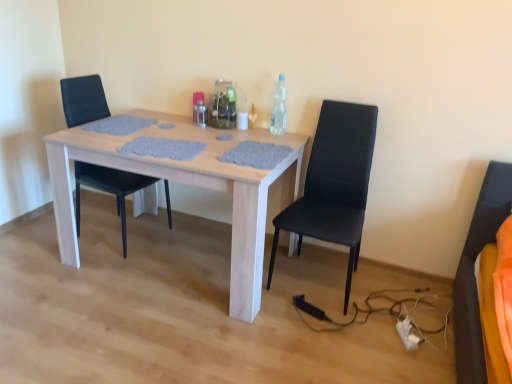
Question: Should I look upward or downward to see black leather chair at center, the 1th chair viewed from the left?

Choices:
 (A) up
 (B) down

Answer: (A)

Question: Which direction should I rotate to look at clear glass bottle at center, the 2th bottle from the left?

Choices:
 (A) right
 (B) left

Answer: (B)

Question: Considering the relative positions of black leather chair at center, marked as the second chair in a right-to-left arrangement, and white fabric extension cord at lower right in the image provided, is black leather chair at center, marked as the second chair in a right-to-left arrangement, to the right of white fabric extension cord at lower right from the viewer's perspective?

Choices:
 (A) yes
 (B) no

Answer: (B)

Question: Is black leather chair at center, marked as the second chair in a right-to-left arrangement, closer to the viewer compared to white fabric extension cord at lower right?

Choices:
 (A) yes
 (B) no

Answer: (B)

Question: Is black leather chair at center, the 1th chair viewed from the left, beside white fabric extension cord at lower right?

Choices:
 (A) yes
 (B) no

Answer: (B)

Question: Is black leather chair at center, the 1th chair viewed from the left, looking in the opposite direction of white fabric extension cord at lower right?

Choices:
 (A) yes
 (B) no

Answer: (B)

Question: Considering the relative sizes of black leather chair at center, the 1th chair viewed from the left, and white fabric extension cord at lower right in the image provided, is black leather chair at center, the 1th chair viewed from the left, shorter than white fabric extension cord at lower right?

Choices:
 (A) no
 (B) yes

Answer: (A)

Question: Is clear plastic bottle at upper right, placed as the 1th bottle when sorted from right to left, surrounded by black leather chair at center, marked as the second chair in a right-to-left arrangement?

Choices:
 (A) no
 (B) yes

Answer: (A)

Question: Considering the relative sizes of black leather chair at center, the 1th chair viewed from the left, and clear plastic bottle at upper right, placed as the 1th bottle when sorted from right to left, in the image provided, is black leather chair at center, the 1th chair viewed from the left, taller than clear plastic bottle at upper right, placed as the 1th bottle when sorted from right to left,?

Choices:
 (A) no
 (B) yes

Answer: (B)

Question: Is black leather chair at center, the 1th chair viewed from the left, next to clear plastic bottle at upper right, arranged as the third bottle when viewed from the left, and touching it?

Choices:
 (A) yes
 (B) no

Answer: (B)

Question: Is black leather chair at center, marked as the second chair in a right-to-left arrangement, behind clear plastic bottle at upper right, arranged as the third bottle when viewed from the left?

Choices:
 (A) no
 (B) yes

Answer: (A)

Question: Is black leather chair at center, marked as the second chair in a right-to-left arrangement, thinner than clear plastic bottle at upper right, placed as the 1th bottle when sorted from right to left?

Choices:
 (A) yes
 (B) no

Answer: (B)

Question: Are black leather chair at center, the 1th chair viewed from the left, and clear plastic bottle at upper right, placed as the 1th bottle when sorted from right to left, far apart?

Choices:
 (A) yes
 (B) no

Answer: (B)

Question: From the image's perspective, is black leather chair at right, arranged as the second chair when viewed from the left, on top of white fabric extension cord at lower right?

Choices:
 (A) yes
 (B) no

Answer: (A)